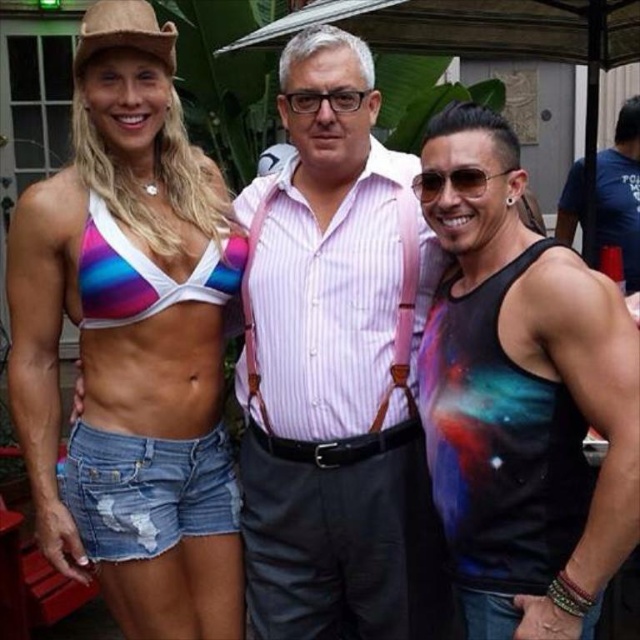
Between black cotton t-shirt at right and brown felt cowboy hat at upper left, which one has more height?

Standing taller between the two is black cotton t-shirt at right.

Consider the image. Who is more distant from viewer, (602, 184) or (148, 35)?

The point (602, 184) is more distant.

The width and height of the screenshot is (640, 640). Describe the element at coordinates (620, 192) in the screenshot. I see `black cotton t-shirt at right` at that location.

The image size is (640, 640). In order to click on black cotton t-shirt at right in this screenshot , I will do [620, 192].

Does point (467, 163) come closer to viewer compared to point (83, 502)?

Yes, point (467, 163) is closer to viewer.

Who is more forward, (483, 579) or (211, 481)?

Positioned in front is point (483, 579).

Image resolution: width=640 pixels, height=640 pixels. Find the location of `black printed tank top at center`. black printed tank top at center is located at coordinates (522, 396).

Does rainbow fabric bikini top at upper left have a smaller size compared to pink striped shirt at center?

Incorrect, rainbow fabric bikini top at upper left is not smaller in size than pink striped shirt at center.

Is rainbow fabric bikini top at upper left thinner than pink striped shirt at center?

Indeed, rainbow fabric bikini top at upper left has a lesser width compared to pink striped shirt at center.

Where is `rainbow fabric bikini top at upper left`? rainbow fabric bikini top at upper left is located at coordinates (131, 340).